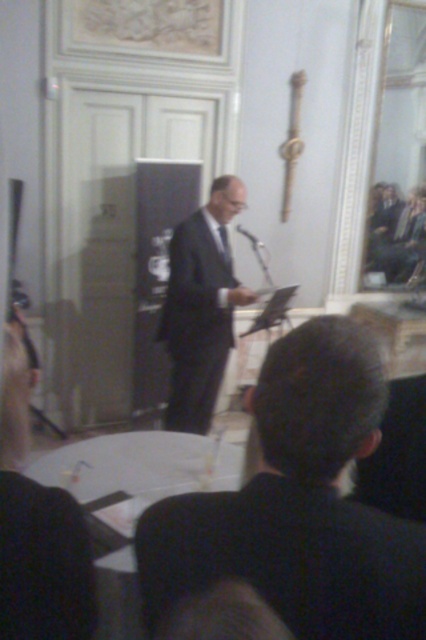
You are attending this event and want to approach the speaker who is wearing the dark suit at center. However, you need to pass by the black plastic microphone at center first. Based on the description, which object should you move towards first to reach the speaker?

The dark suit at center is positioned on the right side of black plastic microphone at center. To reach the speaker wearing the dark suit at center, you should first move towards the black plastic microphone at center and then go to its right side.

You are organizing a small meeting and need to place a 1.5 meter wide screen between the matte black suit at center and the black plastic microphone at center. Can the screen fit between them without overlapping either object?

The matte black suit at center is larger in size than the black plastic microphone at center, but the description does not provide information about the distance between them. Therefore, it is impossible to determine if the screen can fit between them.

You are a photographer who wants to capture a clear shot of the man in the dark suit standing at point (213, 248). The camera you are using has a focal length of 50mm and an aperture of f2.8. Given that the point and the camera are 10.39 feet apart, what is the minimum distance you need to move closer to ensure the man is in focus if the depth of field at f2.8 allows for sharpness within 8 feet of the camera?

The point (213, 248) is 10.39 feet away from the camera. Since the depth of field at f2.8 allows sharpness within 8 feet, the photographer needs to move closer so that the distance between the camera and the point is within 8 feet. Therefore, the minimum distance to move closer is 10.39 feet minus 8 feet, which equals 2.39 feet closer.